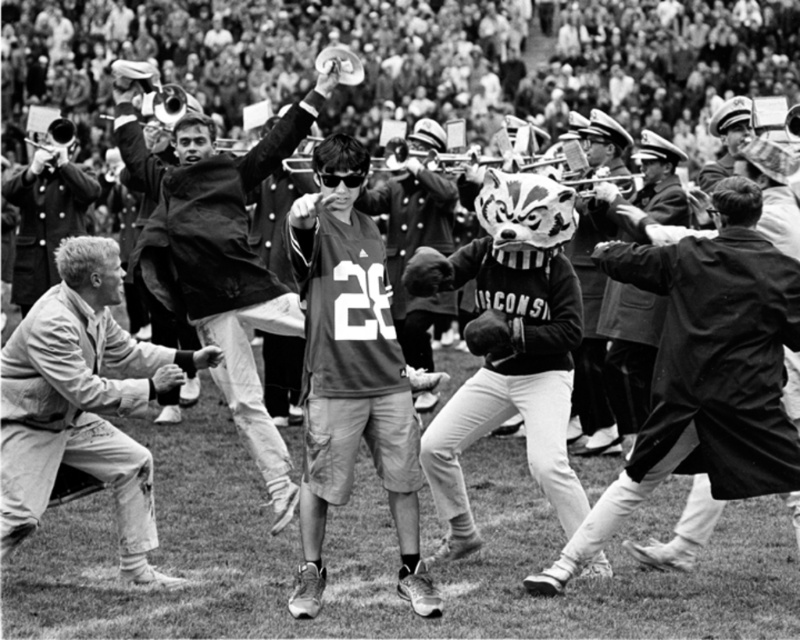
You are a photographer at the event and want to ensure both the smooth black coat at center and the black matte mascot at center are clearly visible in your photo. Given their height difference, which object should you focus on first to ensure proper framing?

The smooth black coat at center has a lesser height compared to the black matte mascot at center, so you should focus on the black matte mascot at center first to ensure it is properly framed within the shot.

You are a photographer at the sports event and want to capture a photo of the matte black jersey at center without the light beige cotton pants at lower left appearing in the frame. Based on their positions, is this possible?

The light beige cotton pants at lower left are positioned to the left of the matte black jersey at center, so by adjusting the camera angle to exclude the left side of the frame, the photographer can capture the matte black jersey at center without the light beige cotton pants at lower left appearing in the shot.